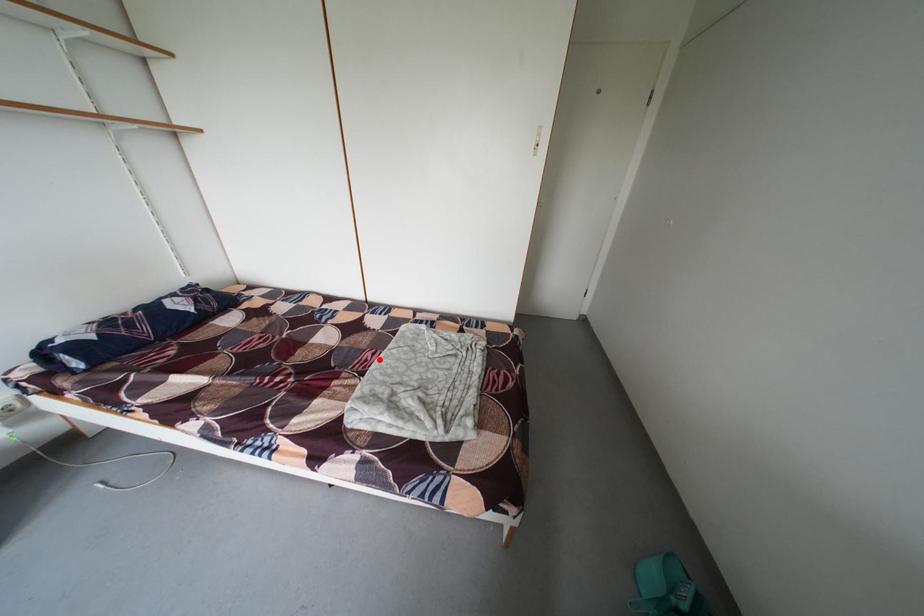
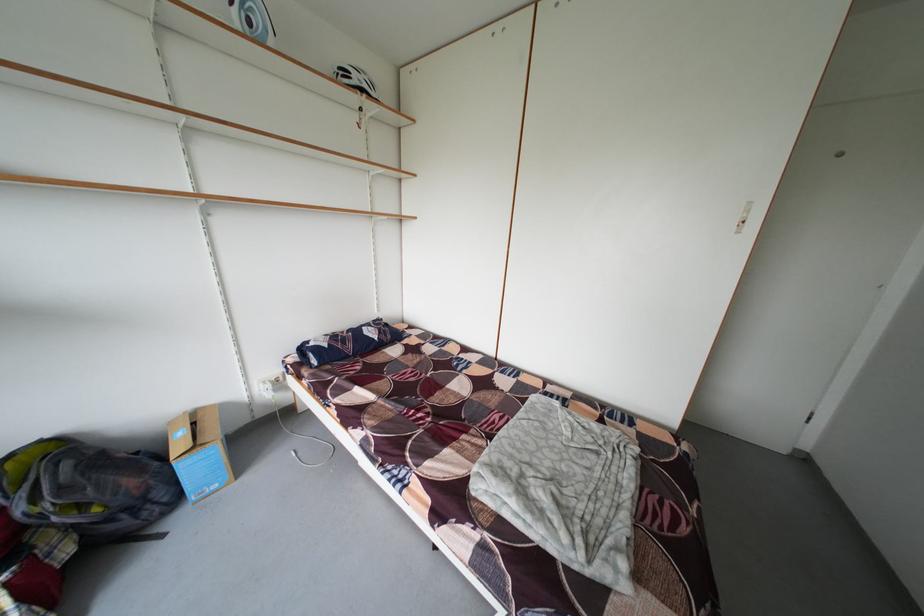
The point at the highlighted location is marked in the first image. Where is the corresponding point in the second image?

(506, 422)